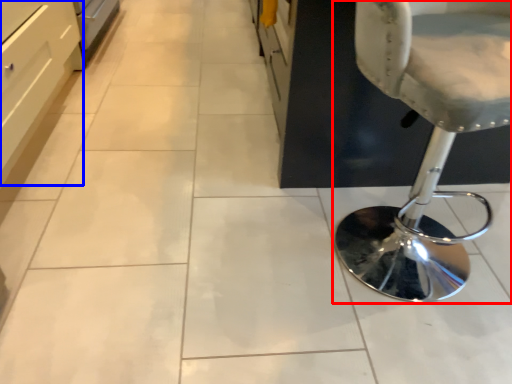
Question: Among these objects, which one is farthest to the camera, chair (highlighted by a red box) or drawer (highlighted by a blue box)?

Choices:
 (A) chair
 (B) drawer

Answer: (B)